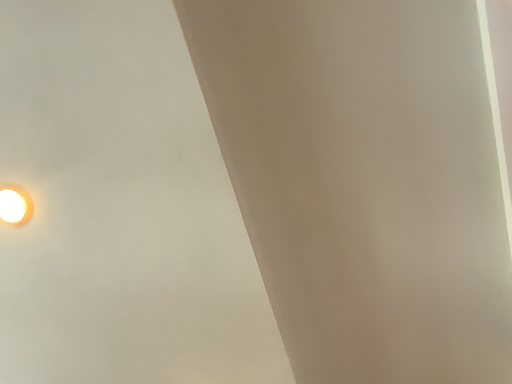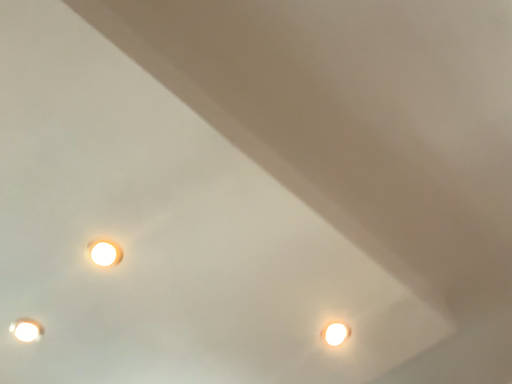
Question: Which way did the camera rotate in the video?

Choices:
 (A) rotated left
 (B) rotated right

Answer: (A)